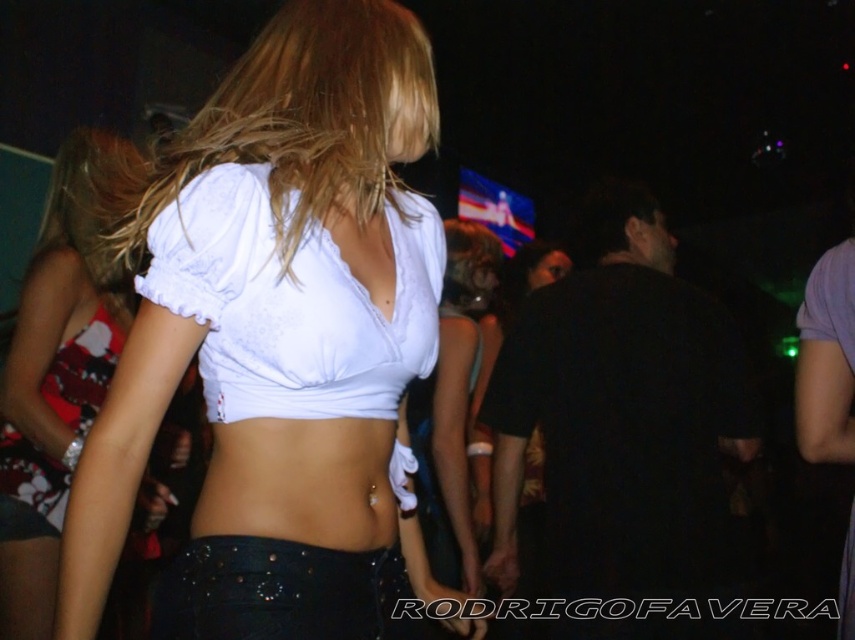
You are a photographer at the nightclub. You need to capture a photo of the person at the center wearing the white lace bikini top at center and blondehair at center. Which object is narrower when viewed from your position?

The white lace bikini top at center has a lesser width compared to the blondehair at center, so the white lace bikini top at center is narrower.

You are a fashion designer observing a model wearing two tops at the same time. The tops are the white matte fabric top at center and the white cotton top at center. Which top is more to the right?

The white matte fabric top at center is positioned on the right side of the white cotton top at center, so the white matte fabric top at center is more to the right.

You are a fashion designer observing a model wearing two tops in a nightclub setting. The tops are the white matte fabric top at center and the white cotton top at center. Which top is closer to the DJ screen displaying vibrant graphics in the background?

The white cotton top at center is closer to the DJ screen displaying vibrant graphics in the background because the white matte fabric top at center and white cotton top at center are 16.40 inches apart from each other.